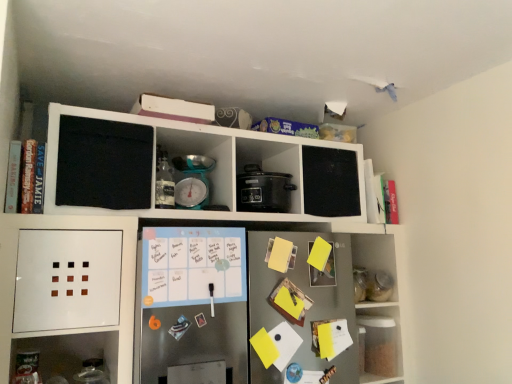
Question: In terms of width, does yellow paper at center, the second book from the right, look wider or thinner when compared to clear plastic container at lower right, marked as the 1th shelf in a right-to-left arrangement?

Choices:
 (A) thin
 (B) wide

Answer: (A)

Question: From the image's perspective, is yellow paper at center, placed as the 2th book when sorted from front to back, positioned above or below clear plastic container at lower right, marked as the 1th shelf in a right-to-left arrangement?

Choices:
 (A) below
 (B) above

Answer: (B)

Question: Estimate the real-world distances between objects in this image. Which object is closer to the yellow paper at center, the second book from the right?

Choices:
 (A) teal plastic scale at center, the 2th appliance when ordered from right to left
 (B) hardcover book at left, the third book positioned from the right
 (C) white matte refrigerator at center, the 1th shelf in the left-to-right sequence
 (D) black matte slow cooker at center, the first appliance viewed from the right
 (E) clear plastic container at lower right, marked as the 1th shelf in a right-to-left arrangement

Answer: (C)

Question: Based on their relative distances, which object is nearer to the black matte slow cooker at center, acting as the 2th appliance starting from the left?

Choices:
 (A) yellow paper at center, the second book from the right
 (B) teal plastic scale at center, the 2th appliance when ordered from right to left
 (C) white matte refrigerator at center, the 1th shelf in the left-to-right sequence
 (D) hardcover book at left, the 1th book viewed from the front
 (E) hardcover book at upper right, the first book when ordered from right to left

Answer: (B)